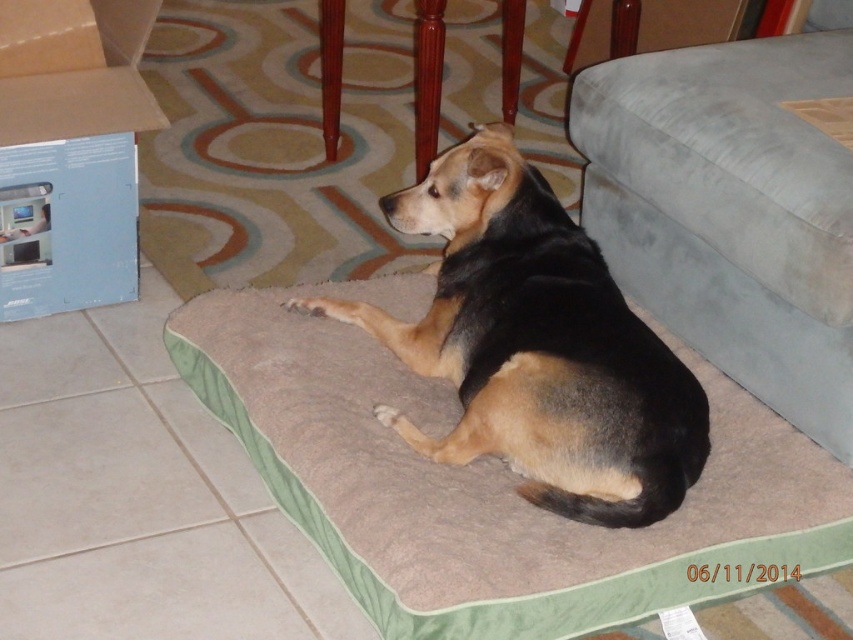
Question: Which object appears farthest from the camera in this image?

Choices:
 (A) beige soft dog bed at center
 (B) velvet blue couch at right

Answer: (B)

Question: Where is beige soft dog bed at center located in relation to blue cardboard box at lower left in the image?

Choices:
 (A) right
 (B) left

Answer: (A)

Question: Which object appears closest to the camera in this image?

Choices:
 (A) brown fur dog at center
 (B) beige soft dog bed at center

Answer: (B)

Question: Which point appears farthest from the camera in this image?

Choices:
 (A) (380, 632)
 (B) (758, 148)
 (C) (50, 22)
 (D) (440, 180)

Answer: (C)

Question: Is velvet blue couch at right thinner than brown fur dog at center?

Choices:
 (A) no
 (B) yes

Answer: (B)

Question: Can you confirm if velvet blue couch at right is positioned to the right of blue cardboard box at lower left?

Choices:
 (A) no
 (B) yes

Answer: (B)